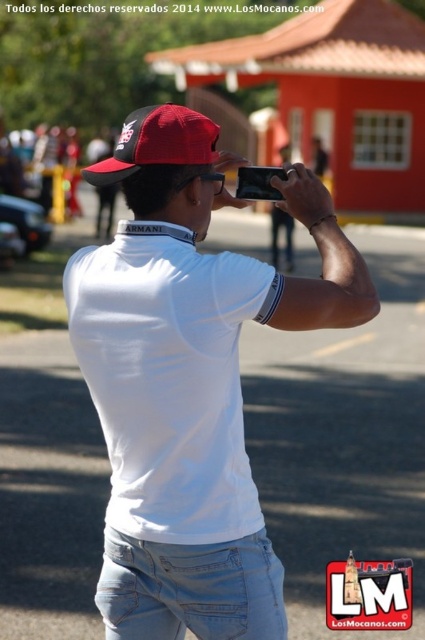
Consider the image. Can you confirm if white cotton t-shirt at center is shorter than light blue denim jeans at center?

No, white cotton t-shirt at center is not shorter than light blue denim jeans at center.

Is the position of white cotton t-shirt at center more distant than that of light blue denim jeans at center?

No.

Does point (227, 428) come farther from viewer compared to point (241, 538)?

Yes, it is.

The height and width of the screenshot is (640, 425). Identify the location of white cotton t-shirt at center. (169, 378).

Is white cotton t-shirt at center above red matte cap at center?

No.

Does white cotton t-shirt at center have a lesser width compared to red matte cap at center?

Incorrect, white cotton t-shirt at center's width is not less than red matte cap at center's.

Locate an element on the screen. The width and height of the screenshot is (425, 640). white cotton t-shirt at center is located at coordinates (169, 378).

Find the location of a particular element. The height and width of the screenshot is (640, 425). white cotton t-shirt at center is located at coordinates (169, 378).

Consider the image. Who is higher up, light blue denim jeans at center or red matte cap at center?

red matte cap at center

Which is in front, point (257, 586) or point (149, 129)?

Point (149, 129)

The height and width of the screenshot is (640, 425). I want to click on light blue denim jeans at center, so click(x=190, y=589).